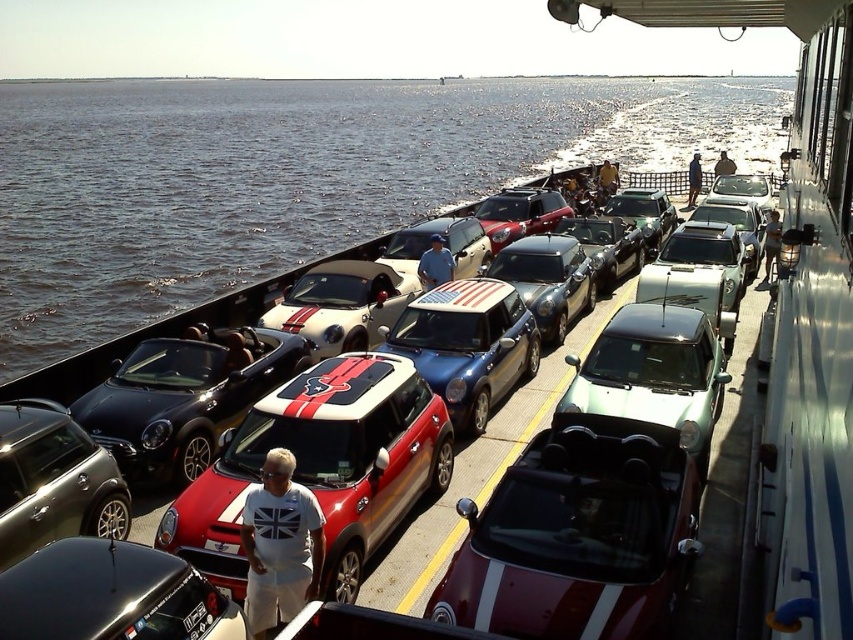
Question: Which object is positioned closest to the shiny red convertible at center?

Choices:
 (A) red matte car at center
 (B) shiny metallic car at center
 (C) blue water at center

Answer: (B)

Question: Is shiny red convertible at center below red matte car at center?

Choices:
 (A) no
 (B) yes

Answer: (B)

Question: Where is shiny metallic car at center located in relation to blue metallic car at center in the image?

Choices:
 (A) right
 (B) left

Answer: (A)

Question: Does blue water at center lie behind shiny red convertible at center?

Choices:
 (A) yes
 (B) no

Answer: (A)

Question: Among these objects, which one is nearest to the camera?

Choices:
 (A) blue metallic car at center
 (B) shiny metallic car at center
 (C) red matte car at center

Answer: (C)

Question: Among these objects, which one is nearest to the camera?

Choices:
 (A) shiny metallic car at center
 (B) red matte car at center
 (C) blue metallic car at center

Answer: (B)